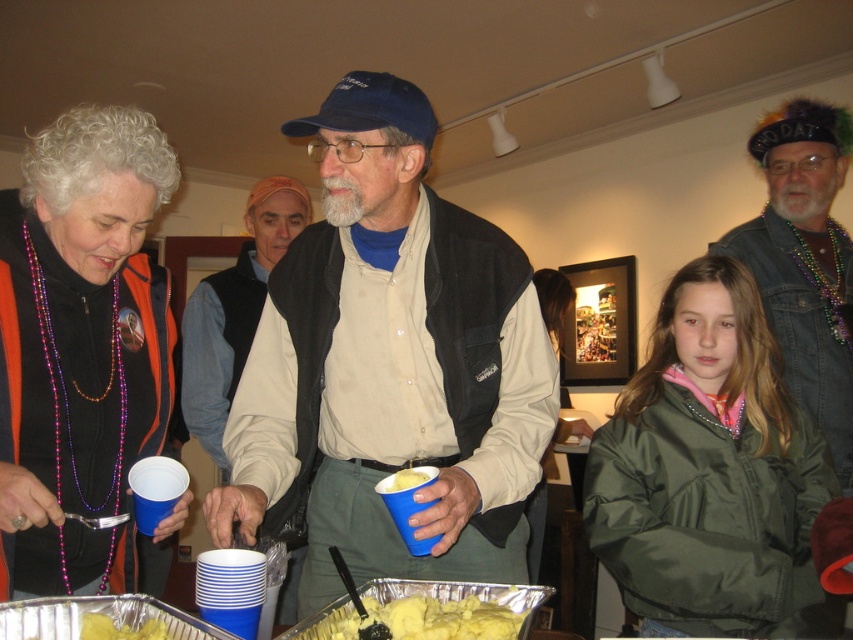
You are at a party and want to serve yourself. You see the yellow mashed potatoes at center and the yellow matte cupcake at center on the table. Which one is bigger?

The yellow mashed potatoes at center are larger in size compared to the yellow matte cupcake at center.

In the scene described, there are an orange fabric vest at left and yellow mashed potatoes at center. From the perspective of someone standing at the table, which object is positioned to the left?

The orange fabric vest at left is positioned to the left of the yellow mashed potatoes at center.